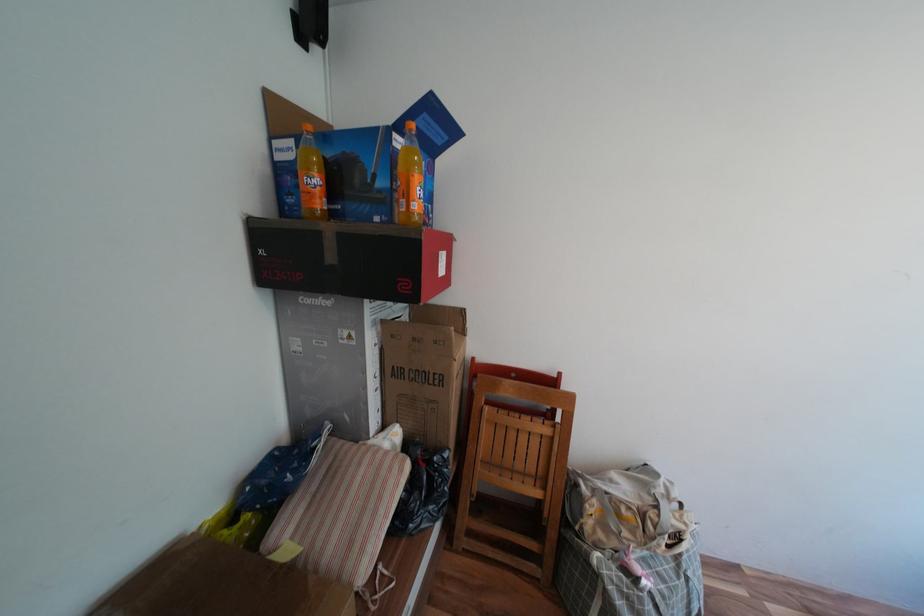
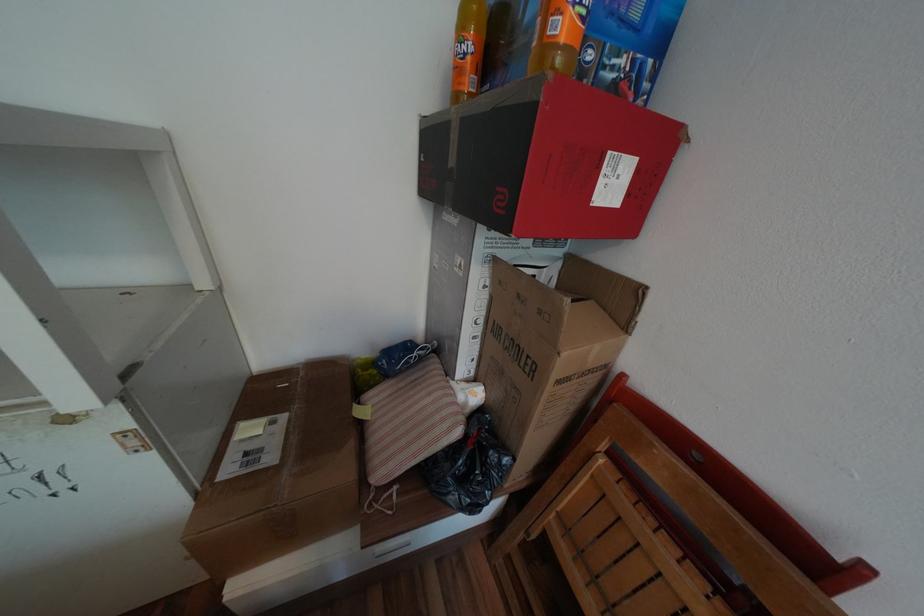
The point at (448, 265) is marked in the first image. Where is the corresponding point in the second image?

(611, 182)